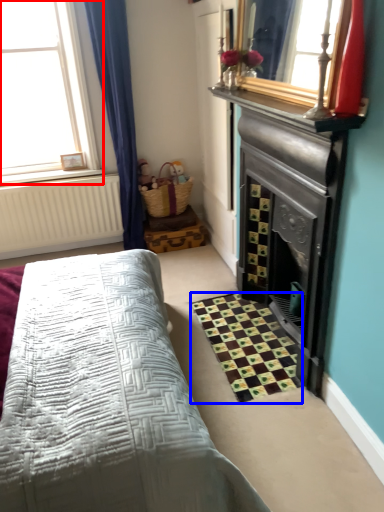
Question: Which object appears closest to the camera in this image, window (highlighted by a red box) or pattern (highlighted by a blue box)?

Choices:
 (A) window
 (B) pattern

Answer: (B)